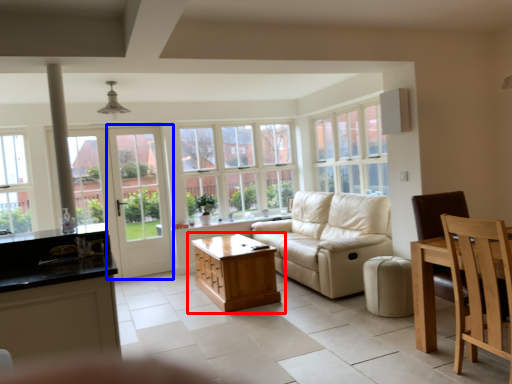
Question: Among these objects, which one is farthest to the camera, table (highlighted by a red box) or screen door (highlighted by a blue box)?

Choices:
 (A) table
 (B) screen door

Answer: (B)